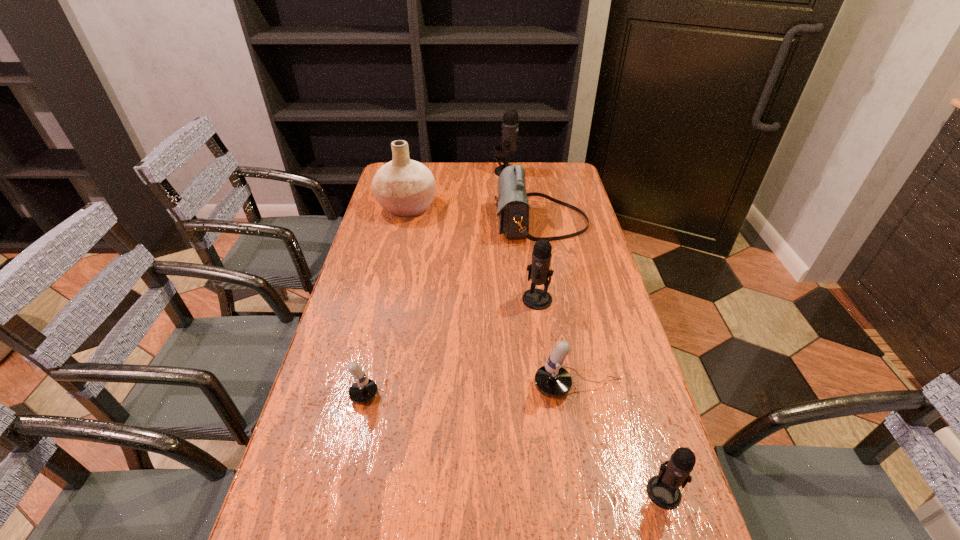
Where is `microphone that is at the left edge`? The height and width of the screenshot is (540, 960). microphone that is at the left edge is located at coordinates (364, 390).

Image resolution: width=960 pixels, height=540 pixels. I want to click on shoulder bag located in the right edge section of the desktop, so click(x=512, y=204).

Image resolution: width=960 pixels, height=540 pixels. I want to click on vacant space at the left edge of the desktop, so click(376, 286).

In the image, there is a desktop. Identify the location of vacant region at the right edge. This screenshot has width=960, height=540. (575, 289).

The width and height of the screenshot is (960, 540). Find the location of `free point at the far right corner`. free point at the far right corner is located at coordinates (537, 167).

Where is `unoccupied area between the right white microphone and the shoulder bag`? The image size is (960, 540). unoccupied area between the right white microphone and the shoulder bag is located at coordinates (560, 305).

Where is `empty location between the shoulder bag and the pottery`? This screenshot has height=540, width=960. empty location between the shoulder bag and the pottery is located at coordinates (474, 215).

At what (x,y) coordinates should I click in order to perform the action: click on free spot between the farthest object and the shortest microphone. Please return your answer as a coordinate pair (x, y). This screenshot has height=540, width=960. Looking at the image, I should click on (425, 285).

This screenshot has width=960, height=540. In order to click on free space between the tallest microphone and the leftmost microphone in this screenshot , I will do (x=425, y=285).

Identify the location of blank region between the leftmost microphone and the shoulder bag. The height and width of the screenshot is (540, 960). (443, 309).